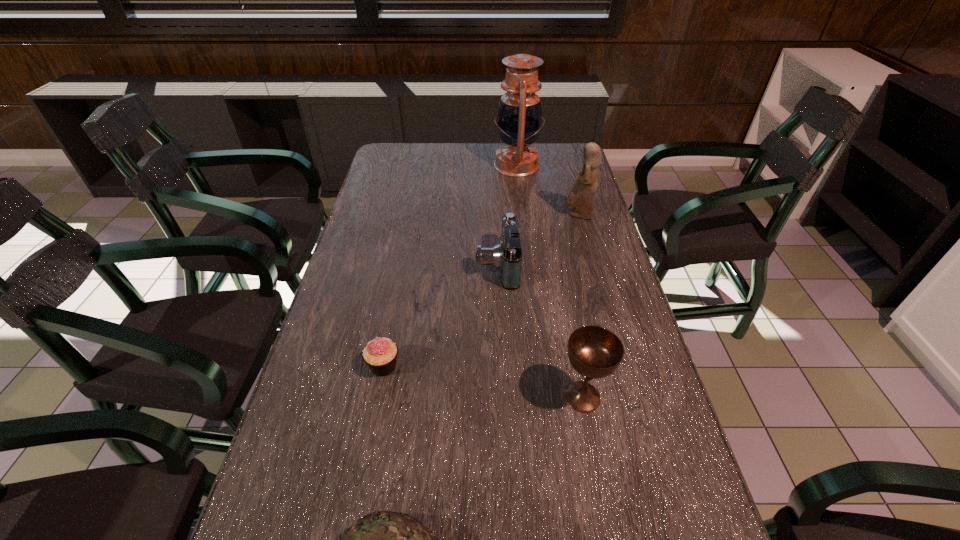
Where is `blank region between the cupcake and the tallest object`? The image size is (960, 540). blank region between the cupcake and the tallest object is located at coordinates (450, 266).

You are a GUI agent. You are given a task and a screenshot of the screen. Output one action in this format:
    pyautogui.click(x=<x>, y=<y>)
    Task: Click on the third closest object to the nearest object
    This screenshot has height=540, width=960.
    Given the screenshot: What is the action you would take?
    pyautogui.click(x=506, y=256)

Choose which object is the nearest neighbor to the farthest object. Please provide its 2D coordinates. Your answer should be formatted as a tuple, i.e. [(x, y)], where the tuple contains the x and y coordinates of a point satisfying the conditions above.

[(582, 195)]

Where is `vacant space that satisfies the following two spatial constraints: 1. on the back side of the farthest object; 2. on the left side of the cupcake`? Image resolution: width=960 pixels, height=540 pixels. vacant space that satisfies the following two spatial constraints: 1. on the back side of the farthest object; 2. on the left side of the cupcake is located at coordinates (422, 165).

At what (x,y) coordinates should I click in order to perform the action: click on vacant space that satisfies the following two spatial constraints: 1. on the back side of the cupcake; 2. on the left side of the farthest object. Please return your answer as a coordinate pair (x, y). Image resolution: width=960 pixels, height=540 pixels. Looking at the image, I should click on (422, 165).